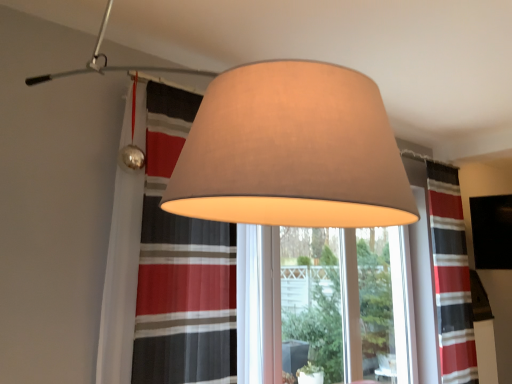
Question: Which direction should I rotate to look at matte gray lampshade at center, placed as the second lamp when sorted from back to front?

Choices:
 (A) left
 (B) right

Answer: (A)

Question: From a real-world perspective, does striped fabric curtain at right stand above matte beige lampshade at upper center, acting as the first lamp starting from the back?

Choices:
 (A) yes
 (B) no

Answer: (B)

Question: From the image's perspective, would you say striped fabric curtain at right is positioned over matte beige lampshade at upper center, the second lamp positioned from the front?

Choices:
 (A) yes
 (B) no

Answer: (B)

Question: Is striped fabric curtain at right next to matte beige lampshade at upper center, acting as the first lamp starting from the back, and touching it?

Choices:
 (A) no
 (B) yes

Answer: (A)

Question: Is striped fabric curtain at right wider than matte beige lampshade at upper center, the second lamp positioned from the front?

Choices:
 (A) yes
 (B) no

Answer: (B)

Question: Considering the relative positions of striped fabric curtain at right and matte beige lampshade at upper center, the second lamp positioned from the front, in the image provided, is striped fabric curtain at right to the left of matte beige lampshade at upper center, the second lamp positioned from the front, from the viewer's perspective?

Choices:
 (A) yes
 (B) no

Answer: (B)

Question: Considering the relative positions of striped fabric curtain at right and matte beige lampshade at upper center, the second lamp positioned from the front, in the image provided, is striped fabric curtain at right to the right of matte beige lampshade at upper center, the second lamp positioned from the front, from the viewer's perspective?

Choices:
 (A) yes
 (B) no

Answer: (A)

Question: Does matte beige lampshade at upper center have a lesser height compared to striped fabric curtain at right?

Choices:
 (A) no
 (B) yes

Answer: (B)

Question: Is matte beige lampshade at upper center oriented towards striped fabric curtain at right?

Choices:
 (A) no
 (B) yes

Answer: (A)

Question: Is matte beige lampshade at upper center positioned beyond the bounds of striped fabric curtain at right?

Choices:
 (A) no
 (B) yes

Answer: (B)

Question: Is matte beige lampshade at upper center further to the viewer compared to striped fabric curtain at right?

Choices:
 (A) yes
 (B) no

Answer: (B)

Question: Is matte beige lampshade at upper center at the left side of striped fabric curtain at right?

Choices:
 (A) no
 (B) yes

Answer: (B)

Question: From the image's perspective, is matte beige lampshade at upper center under striped fabric curtain at right?

Choices:
 (A) yes
 (B) no

Answer: (B)

Question: Considering the relative sizes of matte gray lampshade at center, the first lamp when ordered from front to back, and matte beige lampshade at upper center in the image provided, is matte gray lampshade at center, the first lamp when ordered from front to back, smaller than matte beige lampshade at upper center?

Choices:
 (A) no
 (B) yes

Answer: (A)